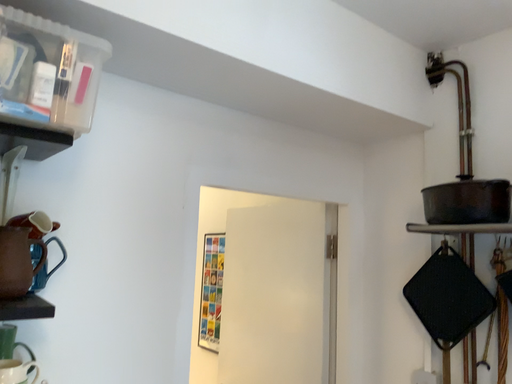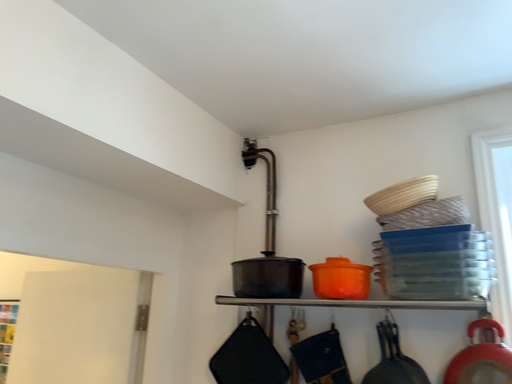
Question: Which way did the camera rotate in the video?

Choices:
 (A) rotated upward
 (B) rotated downward

Answer: (A)